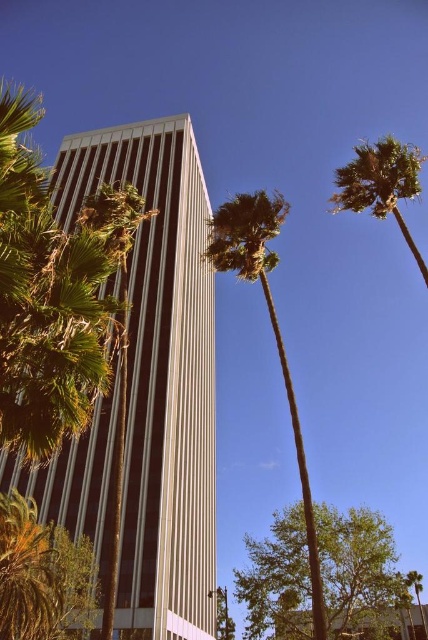
Question: Does green leafy palm tree at left appear under green leafy tree at lower left?

Choices:
 (A) yes
 (B) no

Answer: (B)

Question: From the image, what is the correct spatial relationship of white striped building at center in relation to green leafy palm tree at left?

Choices:
 (A) below
 (B) above

Answer: (A)

Question: Among these points, which one is farthest from the camera?

Choices:
 (A) (312, 570)
 (B) (276, 516)
 (C) (180, 244)
 (D) (400, 168)

Answer: (C)

Question: Which point is closer to the camera?

Choices:
 (A) (98, 528)
 (B) (86, 205)
 (C) (302, 552)
 (D) (39, 577)

Answer: (D)

Question: Can you confirm if white striped building at center is positioned to the right of green leafy palm tree at left?

Choices:
 (A) no
 (B) yes

Answer: (B)

Question: Considering the real-world distances, which object is farthest from the green leafy tree at center?

Choices:
 (A) green leafy tree at lower left
 (B) green leafy palm tree at center
 (C) white striped building at center

Answer: (C)